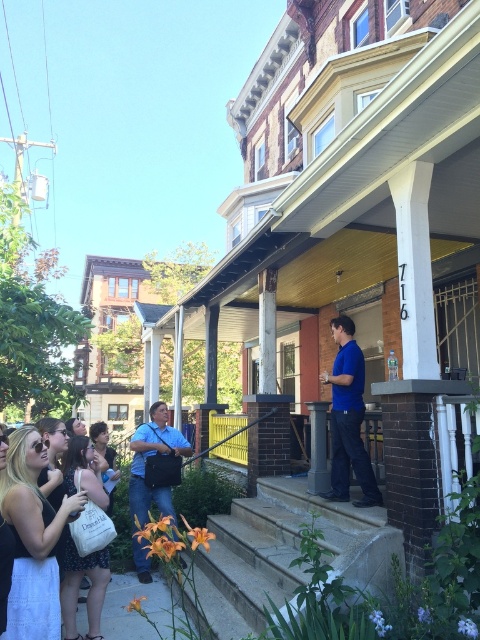
Where is the white cotton dress at lower left located in the image?

The white cotton dress at lower left is located at point (33, 538).

You are standing on the sidewalk and want to go up to the porch. The concrete stairs at center and the smooth gray column at center are in your way. Which one should you move around to reach the porch?

The concrete stairs at center is below the smooth gray column at center, so you should move around the smooth gray column at center to reach the porch.